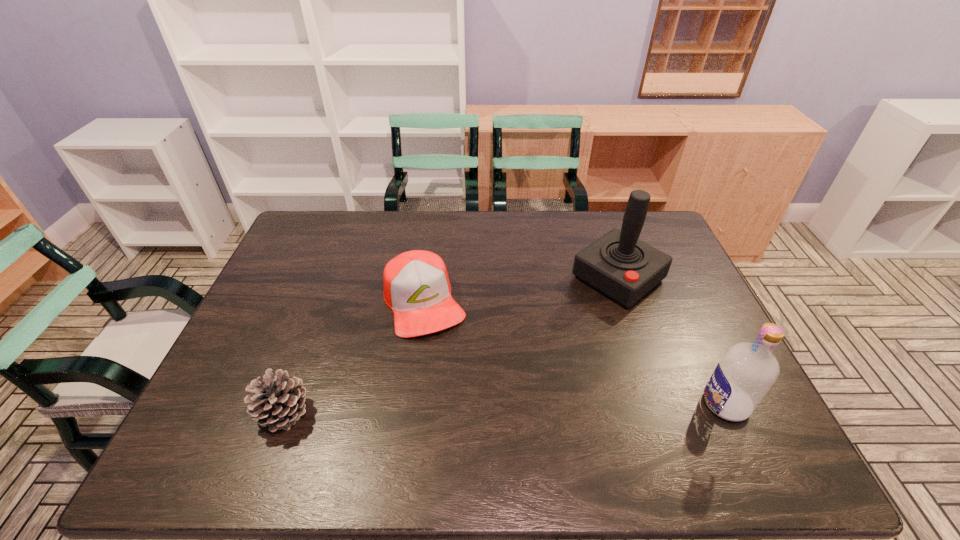
Identify the location of free spot on the desktop that is between the leftmost object and the vodka and is positioned on the front-facing side of the baseball cap. Image resolution: width=960 pixels, height=540 pixels. (470, 408).

You are a GUI agent. You are given a task and a screenshot of the screen. Output one action in this format:
    pyautogui.click(x=<x>, y=<y>)
    Task: Click on the free space on the desktop that is between the leftmost object and the vodka and is positioned on the base of the joystick
    The image size is (960, 540).
    Given the screenshot: What is the action you would take?
    pyautogui.click(x=449, y=409)